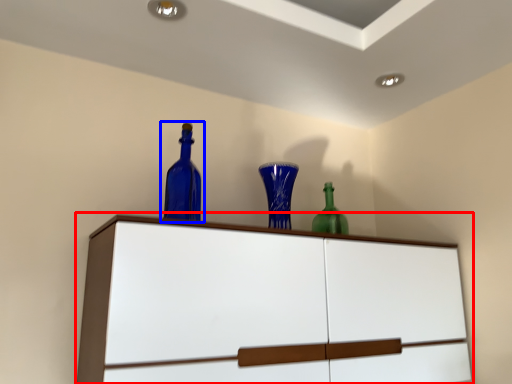
Question: Which point is further to the camera, cupboard (highlighted by a red box) or bottle (highlighted by a blue box)?

Choices:
 (A) cupboard
 (B) bottle

Answer: (B)